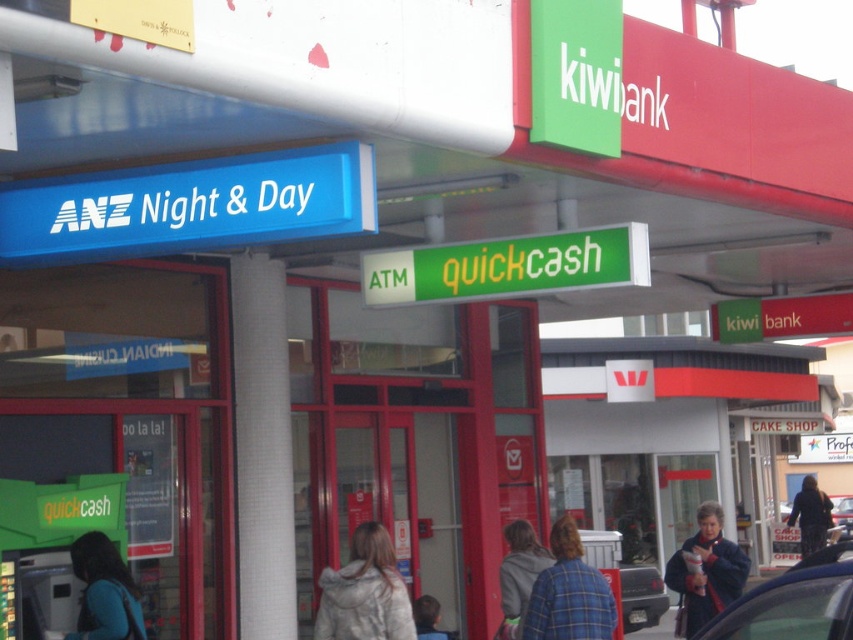
You are a customer standing in front of the KiwiBank branch and notice two people near the entrance. One is wearing a dark blue jacket at lower right, and the other has light brown hair at lower center. Which person is closer to the entrance?

The dark blue jacket at lower right is taller than light brown hair at lower center, so the person in the dark blue jacket at lower right is closer to the entrance.

You are standing outside the KiwiBank branch and notice a blue plaid shirt at lower center and a dark brown textured coat at lower right. Which item is nearer to you?

The blue plaid shirt at lower center is closer to the viewer than the dark brown textured coat at lower right.

You are standing at the entrance of the KiwiBank branch and notice a dark blue jacket at lower right. You want to take a photo of the prominent red and green signage at the top right corner. Is the camera you have in hand close enough to capture the signage without moving from your current position?

The dark blue jacket at lower right and camera are 9.87 meters apart from each other. Since the camera is part of the scene, the distance between them doesn